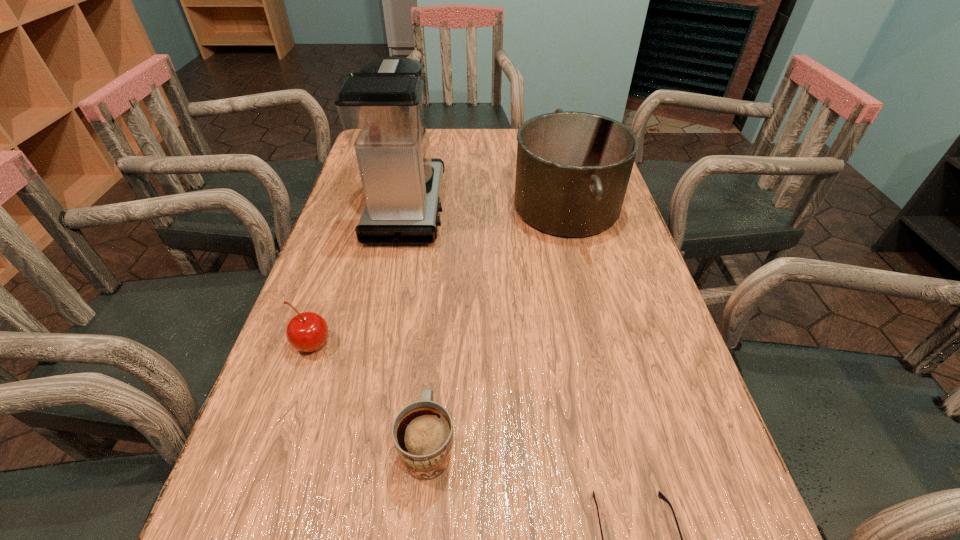
What are the coordinates of `coffee maker` in the screenshot? It's located at (381, 109).

Locate an element on the screen. This screenshot has height=540, width=960. pan is located at coordinates (573, 168).

Where is `the second nearest object`? the second nearest object is located at coordinates (422, 432).

Identify the location of cherry. (308, 331).

At what (x,y) coordinates should I click in order to perform the action: click on vacant space located 0.270m at the front of the tallest object where the controls are located. Please return your answer as a coordinate pair (x, y). Looking at the image, I should click on (545, 208).

Where is `free space located on the left of the pan`? free space located on the left of the pan is located at coordinates (427, 207).

Where is `free space located on the side of the mug with the handle`? This screenshot has height=540, width=960. free space located on the side of the mug with the handle is located at coordinates (442, 299).

Find the location of a particular element. The image size is (960, 540). free space located on the side of the mug with the handle is located at coordinates (442, 299).

Locate an element on the screen. Image resolution: width=960 pixels, height=540 pixels. free space located 0.270m on the side of the mug with the handle is located at coordinates (442, 295).

Find the location of a particular element. free space located on the right of the cherry is located at coordinates (425, 345).